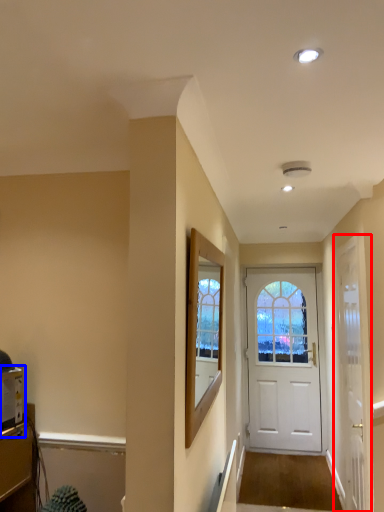
Question: Which object is closer to the camera taking this photo, door (highlighted by a red box) or appliance (highlighted by a blue box)?

Choices:
 (A) door
 (B) appliance

Answer: (B)